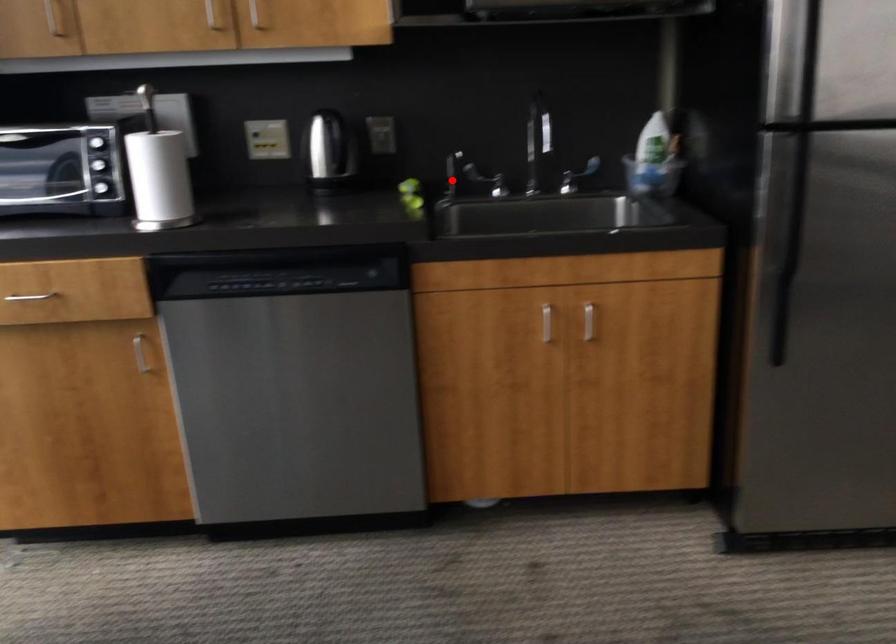
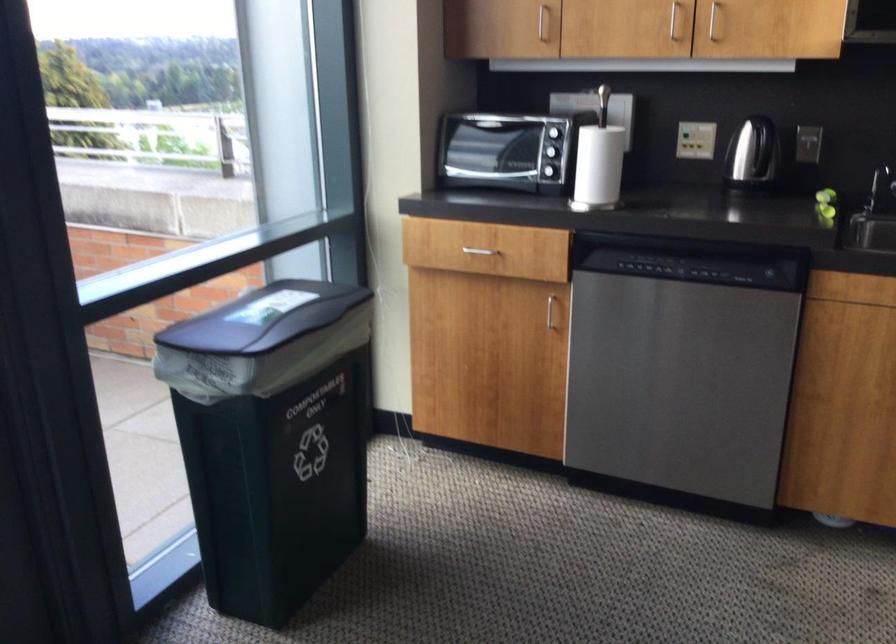
Locate, in the second image, the point that corresponds to the highlighted location in the first image.

(879, 187)